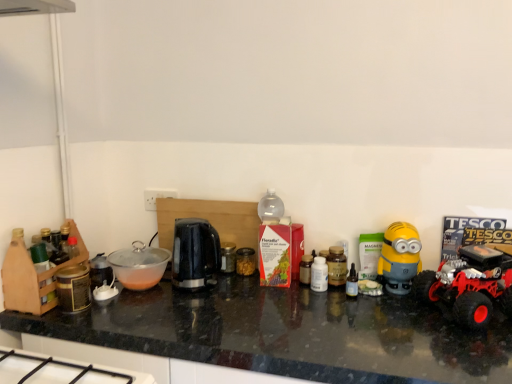
You are a GUI agent. You are given a task and a screenshot of the screen. Output one action in this format:
    pyautogui.click(x=<x>, y=<y>)
    Task: Click on the vacant area that lies between red rubber toy truck at right and yellow matte minion toy at right, positioned as the 1th toy in right-to-left order
    Image resolution: width=512 pixels, height=384 pixels.
    Given the screenshot: What is the action you would take?
    pyautogui.click(x=415, y=311)